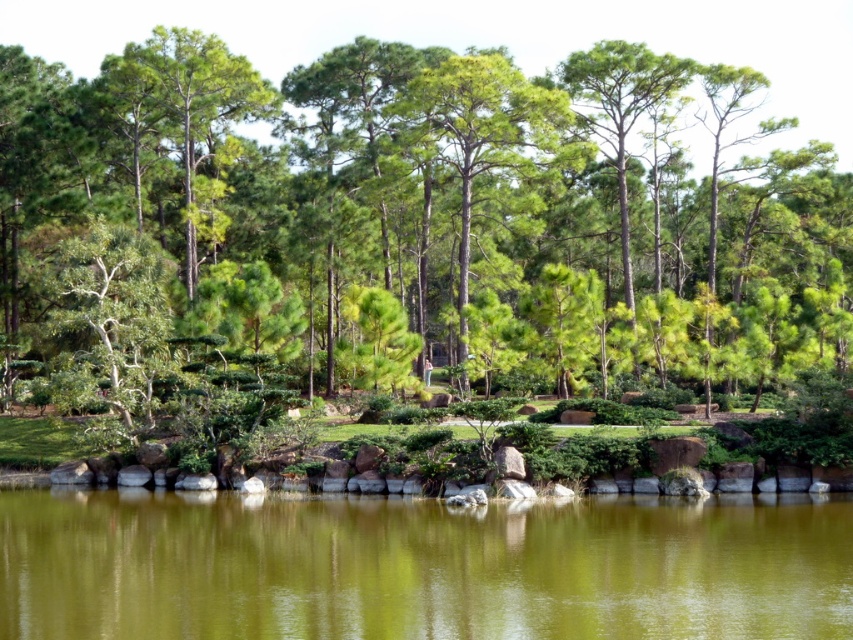
You are standing at the edge of the pond and want to know which object is taller between the green leafy tree at center and the greenish water at center. Can you tell me?

The green leafy tree at center is taller than the greenish water at center.

You are standing at the origin point in the image. You see two points marked as point 1 at coordinates point (x=688, y=221) and point 2 at coordinates point (x=68, y=564). Which point is closer to you?

Point 2 at coordinates point (x=68, y=564) is closer to you because it is in front of point 1 at coordinates point (x=688, y=221).